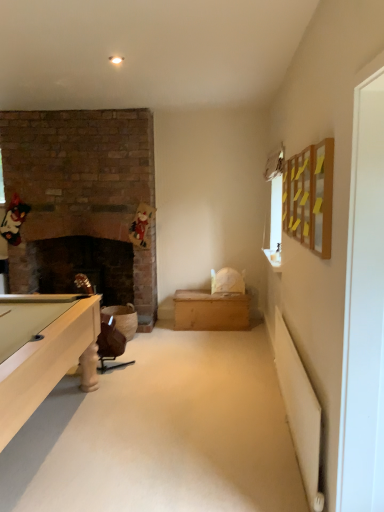
Find the location of `white wooden door at right`. white wooden door at right is located at coordinates (364, 311).

What do you see at coordinates (364, 311) in the screenshot?
I see `white wooden door at right` at bounding box center [364, 311].

You are a GUI agent. You are given a task and a screenshot of the screen. Output one action in this format:
    pyautogui.click(x=<x>, y=<y>)
    Task: Click on the white wooden door at right
    
    Given the screenshot: What is the action you would take?
    pyautogui.click(x=364, y=311)